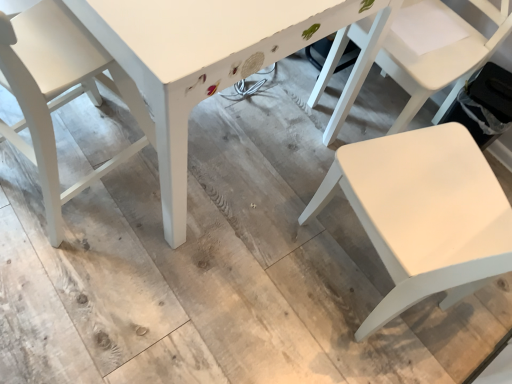
Question: Is white painted wood table at center situated inside white matte chair at lower right, the 2th chair viewed from the right, or outside?

Choices:
 (A) inside
 (B) outside

Answer: (B)

Question: From a real-world perspective, is white painted wood table at center above or below white matte chair at lower right, which is the 2th chair from left to right?

Choices:
 (A) below
 (B) above

Answer: (A)

Question: Which of these objects is positioned closest to the white matte chair at lower right, the 2th chair viewed from the right?

Choices:
 (A) white matte chair at left, which is counted as the 1th chair, starting from the left
 (B) white painted wood table at center
 (C) white matte chair at right, placed as the 1th chair when sorted from right to left

Answer: (C)

Question: Based on their relative distances, which object is farther from the white painted wood table at center?

Choices:
 (A) white matte chair at right, placed as the 1th chair when sorted from right to left
 (B) white matte chair at lower right, which is the 2th chair from left to right
 (C) white matte chair at left, which is counted as the 1th chair, starting from the left

Answer: (B)